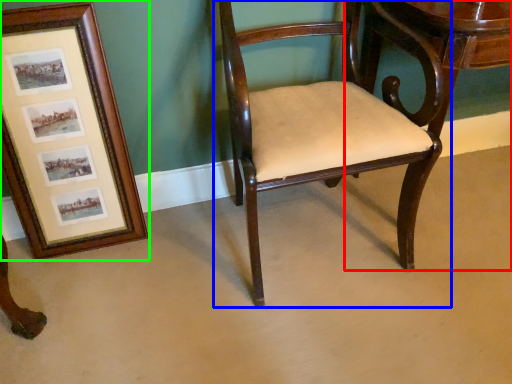
Question: Based on their relative distances, which object is farther from table (highlighted by a red box)? Choose from chair (highlighted by a blue box) and picture frame (highlighted by a green box).

Choices:
 (A) chair
 (B) picture frame

Answer: (B)